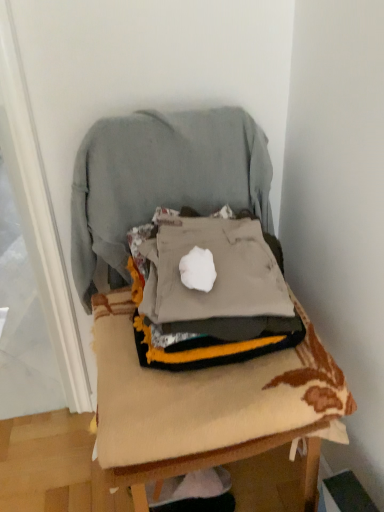
Question: From the image's perspective, is gray cotton sweatshirt at center positioned above or below gray fabric at center?

Choices:
 (A) below
 (B) above

Answer: (B)

Question: In the image, is gray cotton sweatshirt at center positioned in front of or behind gray fabric at center?

Choices:
 (A) behind
 (B) front

Answer: (A)

Question: Estimate the real-world distances between objects in this image. Which object is farther from the textured beige cushion at center?

Choices:
 (A) gray cotton sweatshirt at center
 (B) gray fabric at center

Answer: (A)

Question: Which is nearer to the gray fabric at center?

Choices:
 (A) gray cotton sweatshirt at center
 (B) textured beige cushion at center

Answer: (B)